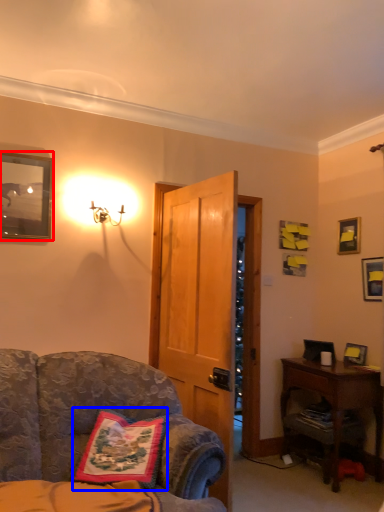
Question: Which point is further to the camera, picture frame (highlighted by a red box) or pillow (highlighted by a blue box)?

Choices:
 (A) picture frame
 (B) pillow

Answer: (A)